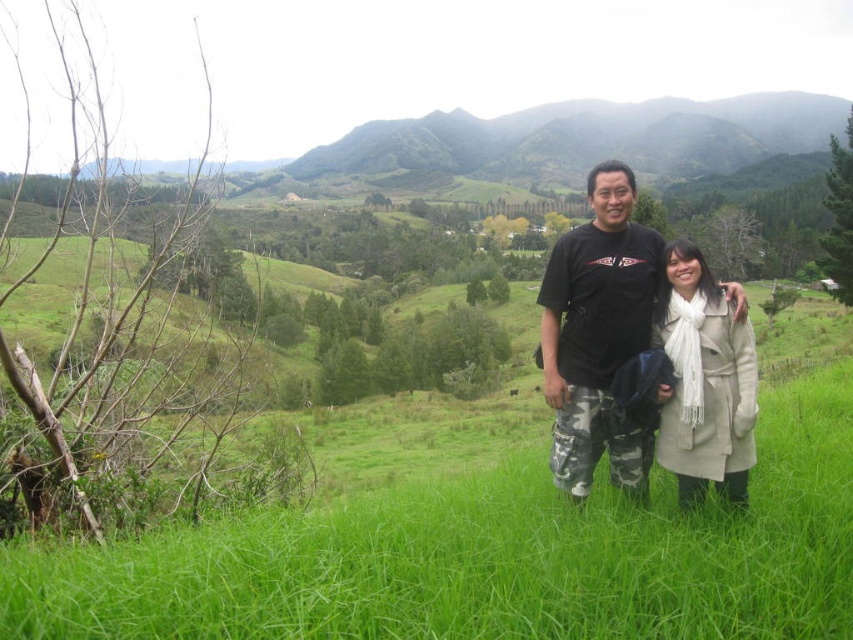
Can you confirm if camouflage pants at center is shorter than beige wool coat at center?

Incorrect, camouflage pants at center's height does not fall short of beige wool coat at center's.

Between point (645, 449) and point (682, 305), which one is positioned behind?

Point (645, 449)

Where is `camouflage pants at center`? The height and width of the screenshot is (640, 853). camouflage pants at center is located at coordinates (599, 333).